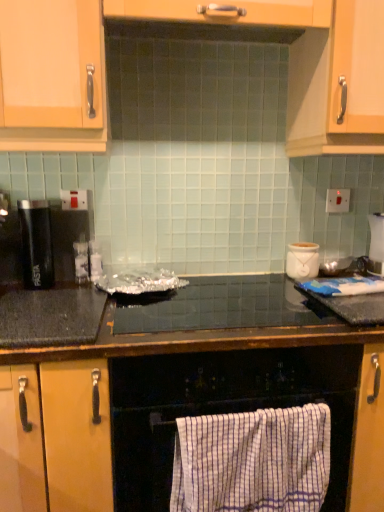
The height and width of the screenshot is (512, 384). What do you see at coordinates (220, 408) in the screenshot?
I see `white checkered towel at lower center` at bounding box center [220, 408].

What are the coordinates of `white checkered towel at lower center` in the screenshot? It's located at (220, 408).

Measure the distance between point (162, 322) and camera.

They are 1.20 meters apart.

Where is `black glossy countertop at center, arranged as the second countertop when ordered from the bottom`? The width and height of the screenshot is (384, 512). black glossy countertop at center, arranged as the second countertop when ordered from the bottom is located at coordinates (209, 323).

Find the location of a particular element. black granite countertop at center, positioned as the 2th countertop in top-to-bottom order is located at coordinates (186, 397).

Do you think white striped towel at lower center is within white checkered towel at lower center, or outside of it?

white striped towel at lower center can be found inside white checkered towel at lower center.

Can you confirm if white striped towel at lower center is positioned to the right of white checkered towel at lower center?

Yes.

From the image's perspective, is white striped towel at lower center under white checkered towel at lower center?

Yes, from the image's perspective, white striped towel at lower center is beneath white checkered towel at lower center.

At what (x,y) coordinates should I click in order to perform the action: click on oven that appears below the white striped towel at lower center (from a real-world perspective). Please return your answer as a coordinate pair (x, y). The height and width of the screenshot is (512, 384). Looking at the image, I should click on (220, 408).

Which object is thinner, black matte pasta container at left or white striped towel at lower center?

Thinner between the two is black matte pasta container at left.

Which object is further away from the camera taking this photo, black matte pasta container at left or white striped towel at lower center?

black matte pasta container at left.

Looking at this image, which is more to the right, black matte pasta container at left or white striped towel at lower center?

white striped towel at lower center.

From a real-world perspective, which is physically below, black matte pasta container at left or white striped towel at lower center?

white striped towel at lower center.

Which object is wider, black matte pasta container at left or white ceramic pot at upper right?

Wider between the two is white ceramic pot at upper right.

I want to click on appliance below the black matte pasta container at left (from the image's perspective), so click(x=302, y=260).

Which is farther, [30,229] or [288,269]?

The point [288,269] is behind.

Is white checkered towel at lower center bigger or smaller than white striped towel at lower center?

Considering their sizes, white checkered towel at lower center takes up more space than white striped towel at lower center.

Considering the relative sizes of white checkered towel at lower center and white striped towel at lower center in the image provided, is white checkered towel at lower center shorter than white striped towel at lower center?

Incorrect, the height of white checkered towel at lower center does not fall short of that of white striped towel at lower center.

The image size is (384, 512). I want to click on beach towel behind the white checkered towel at lower center, so click(253, 461).

Considering the positions of objects white checkered towel at lower center and white striped towel at lower center in the image provided, who is more to the right, white checkered towel at lower center or white striped towel at lower center?

white striped towel at lower center.

Is white ceramic pot at upper right at the right side of black matte pasta container at left?

Yes.

Is white ceramic pot at upper right oriented towards black matte pasta container at left?

No, white ceramic pot at upper right is not turned towards black matte pasta container at left.

Is point (294, 259) less distant than point (23, 236)?

No.

From the image's perspective, does white ceramic pot at upper right appear lower than black matte pasta container at left?

Yes, from the image's perspective, white ceramic pot at upper right is beneath black matte pasta container at left.

From the picture: Is black glossy countertop at center, arranged as the second countertop when ordered from the bottom, positioned far away from white checkered towel at lower center?

black glossy countertop at center, arranged as the second countertop when ordered from the bottom, is actually quite close to white checkered towel at lower center.

Is white checkered towel at lower center a part of black glossy countertop at center, arranged as the second countertop when ordered from the bottom?

No, white checkered towel at lower center is not surrounded by black glossy countertop at center, arranged as the second countertop when ordered from the bottom.

Between point (138, 319) and point (333, 443), which one is positioned in front?

Positioned in front is point (333, 443).

Would you say black glossy countertop at center, arranged as the second countertop when ordered from the bottom, is to the left or to the right of white checkered towel at lower center in the picture?

Clearly, black glossy countertop at center, arranged as the second countertop when ordered from the bottom, is on the right of white checkered towel at lower center in the image.

Is the depth of white ceramic pot at upper right less than that of black glossy countertop at center, arranged as the second countertop when ordered from the bottom?

No, white ceramic pot at upper right is behind black glossy countertop at center, arranged as the second countertop when ordered from the bottom.

From the image's perspective, is white ceramic pot at upper right beneath black glossy countertop at center, the first countertop viewed from the top?

Incorrect, from the image's perspective, white ceramic pot at upper right is higher than black glossy countertop at center, the first countertop viewed from the top.

Considering the relative sizes of white ceramic pot at upper right and black glossy countertop at center, arranged as the second countertop when ordered from the bottom, in the image provided, is white ceramic pot at upper right taller than black glossy countertop at center, arranged as the second countertop when ordered from the bottom,?

Yes, white ceramic pot at upper right is taller than black glossy countertop at center, arranged as the second countertop when ordered from the bottom.

Locate an element on the screen. The image size is (384, 512). beach towel that appears below the white checkered towel at lower center (from the image's perspective) is located at coordinates click(253, 461).

Identify the location of beach towel in front of the black matte pasta container at left. (253, 461).

Which object lies further to the anchor point black matte pasta container at left, black glossy countertop at center, arranged as the second countertop when ordered from the bottom, or white striped towel at lower center?

white striped towel at lower center is positioned further to the anchor black matte pasta container at left.

When comparing their distances from white striped towel at lower center, does black matte pasta container at left or white ceramic pot at upper right seem further?

black matte pasta container at left is further to white striped towel at lower center.

Based on their spatial positions, is white striped towel at lower center or black matte pasta container at left further from black glossy countertop at center, arranged as the second countertop when ordered from the bottom?

black matte pasta container at left lies further to black glossy countertop at center, arranged as the second countertop when ordered from the bottom, than the other object.

Which object lies further to the anchor point white checkered towel at lower center, black granite countertop at center, positioned as the 2th countertop in top-to-bottom order, or black matte pasta container at left?

black matte pasta container at left is positioned further to the anchor white checkered towel at lower center.

From the image, which object appears to be nearer to white ceramic pot at upper right, black granite countertop at center, positioned as the 2th countertop in top-to-bottom order, or white striped towel at lower center?

black granite countertop at center, positioned as the 2th countertop in top-to-bottom order, is closer to white ceramic pot at upper right.

Based on the photo, based on their spatial positions, is white checkered towel at lower center or white ceramic pot at upper right further from white striped towel at lower center?

white ceramic pot at upper right.

Which object lies further to the anchor point white ceramic pot at upper right, black glossy countertop at center, the first countertop viewed from the top, or white striped towel at lower center?

white striped towel at lower center is further to white ceramic pot at upper right.

Estimate the real-world distances between objects in this image. Which object is further from white checkered towel at lower center, black granite countertop at center, which ranks as the 1th countertop in bottom-to-top order, or white ceramic pot at upper right?

white ceramic pot at upper right is further to white checkered towel at lower center.

Locate an element on the screen. The height and width of the screenshot is (512, 384). beach towel between black granite countertop at center, positioned as the 2th countertop in top-to-bottom order, and white ceramic pot at upper right in the front-back direction is located at coordinates (253, 461).

Locate an element on the screen. beach towel between white checkered towel at lower center and black granite countertop at center, which ranks as the 1th countertop in bottom-to-top order, vertically is located at coordinates (253, 461).

Locate an element on the screen. This screenshot has width=384, height=512. oven between black matte pasta container at left and white striped towel at lower center from left to right is located at coordinates (220, 408).

The height and width of the screenshot is (512, 384). What are the coordinates of `oven between black matte pasta container at left and white ceramic pot at upper right in the horizontal direction` in the screenshot? It's located at (220, 408).